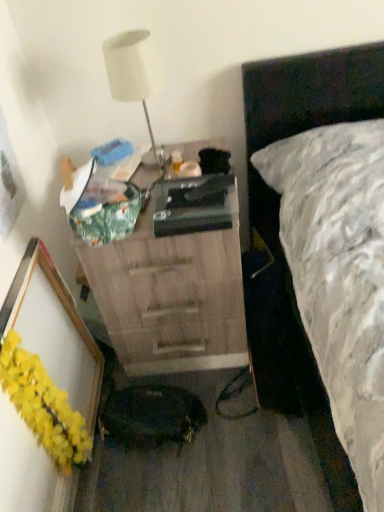
Question: Are yellow fluffy garland at lower left and wooden chest of drawers at center far apart?

Choices:
 (A) no
 (B) yes

Answer: (A)

Question: Is yellow fluffy garland at lower left bigger than wooden chest of drawers at center?

Choices:
 (A) no
 (B) yes

Answer: (A)

Question: Does yellow fluffy garland at lower left have a smaller size compared to wooden chest of drawers at center?

Choices:
 (A) yes
 (B) no

Answer: (A)

Question: From a real-world perspective, is yellow fluffy garland at lower left located beneath wooden chest of drawers at center?

Choices:
 (A) yes
 (B) no

Answer: (B)

Question: From the image's perspective, would you say yellow fluffy garland at lower left is shown under wooden chest of drawers at center?

Choices:
 (A) yes
 (B) no

Answer: (A)

Question: Considering the positions of wooden chest of drawers at center and white matte lamp at upper left in the image, is wooden chest of drawers at center wider or thinner than white matte lamp at upper left?

Choices:
 (A) wide
 (B) thin

Answer: (A)

Question: Is point (231, 296) positioned closer to the camera than point (117, 97)?

Choices:
 (A) farther
 (B) closer

Answer: (A)

Question: From the image's perspective, is wooden chest of drawers at center positioned above or below white matte lamp at upper left?

Choices:
 (A) below
 (B) above

Answer: (A)

Question: Is wooden chest of drawers at center situated inside white matte lamp at upper left or outside?

Choices:
 (A) outside
 (B) inside

Answer: (A)

Question: Is white matte lamp at upper left situated inside wooden chest of drawers at center or outside?

Choices:
 (A) outside
 (B) inside

Answer: (A)

Question: From the image's perspective, is white matte lamp at upper left positioned above or below wooden chest of drawers at center?

Choices:
 (A) above
 (B) below

Answer: (A)

Question: Is white matte lamp at upper left wider or thinner than wooden chest of drawers at center?

Choices:
 (A) thin
 (B) wide

Answer: (A)

Question: Is white matte lamp at upper left taller or shorter than wooden chest of drawers at center?

Choices:
 (A) short
 (B) tall

Answer: (A)

Question: In the image, is wooden chest of drawers at center positioned in front of or behind yellow fluffy garland at lower left?

Choices:
 (A) behind
 (B) front

Answer: (A)

Question: From a real-world perspective, is wooden chest of drawers at center positioned above or below yellow fluffy garland at lower left?

Choices:
 (A) above
 (B) below

Answer: (B)